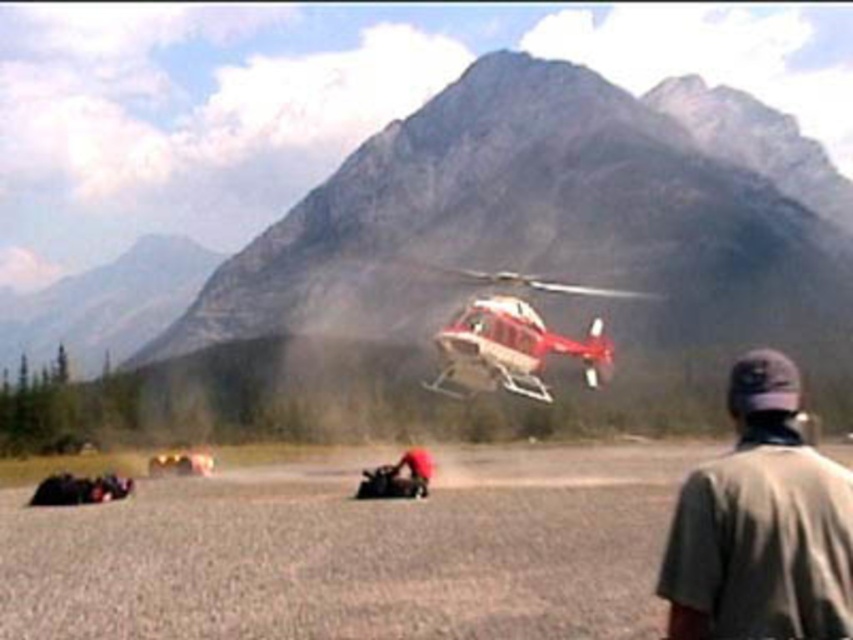
Question: Which point appears closest to the camera in this image?

Choices:
 (A) (753, 369)
 (B) (401, 484)
 (C) (32, 552)

Answer: (A)

Question: Which of the following is the closest to the observer?

Choices:
 (A) (646, 547)
 (B) (486, 74)
 (C) (419, 490)

Answer: (A)

Question: Which of these objects is positioned closest to the brushed metal mountain at upper left?

Choices:
 (A) rugged stone mountain at upper center
 (B) red fabric bag at center
 (C) gray fabric cap at upper right
 (D) red matte helicopter at center

Answer: (A)

Question: Does brown gravel dirt field at center appear over gray fabric cap at upper right?

Choices:
 (A) yes
 (B) no

Answer: (B)

Question: Does gray fabric cap at upper right have a larger size compared to red matte helicopter at center?

Choices:
 (A) yes
 (B) no

Answer: (B)

Question: Does gray fabric cap at upper right appear over red matte helicopter at center?

Choices:
 (A) yes
 (B) no

Answer: (B)